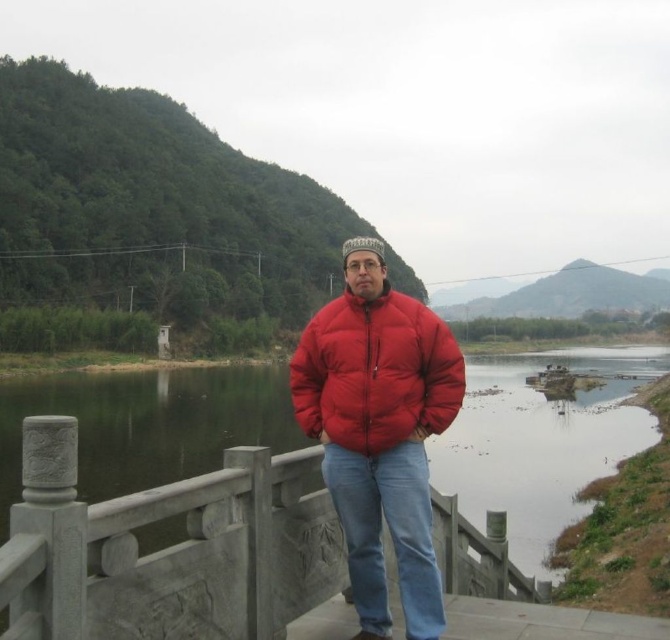
Question: Among these points, which one is farthest from the camera?

Choices:
 (A) (178, 556)
 (B) (348, 340)
 (C) (389, 461)

Answer: (B)

Question: Is red puffy jacket at center wider than red down jacket at center?

Choices:
 (A) yes
 (B) no

Answer: (B)

Question: From the image, what is the correct spatial relationship of gray stone railing at center in relation to red down jacket at center?

Choices:
 (A) below
 (B) above

Answer: (A)

Question: Can you confirm if red puffy jacket at center is bigger than red down jacket at center?

Choices:
 (A) no
 (B) yes

Answer: (B)

Question: Which point is farther to the camera?

Choices:
 (A) (377, 250)
 (B) (180, 545)
 (C) (397, 346)

Answer: (A)

Question: Which point appears farthest from the camera in this image?

Choices:
 (A) (399, 372)
 (B) (444, 360)

Answer: (B)